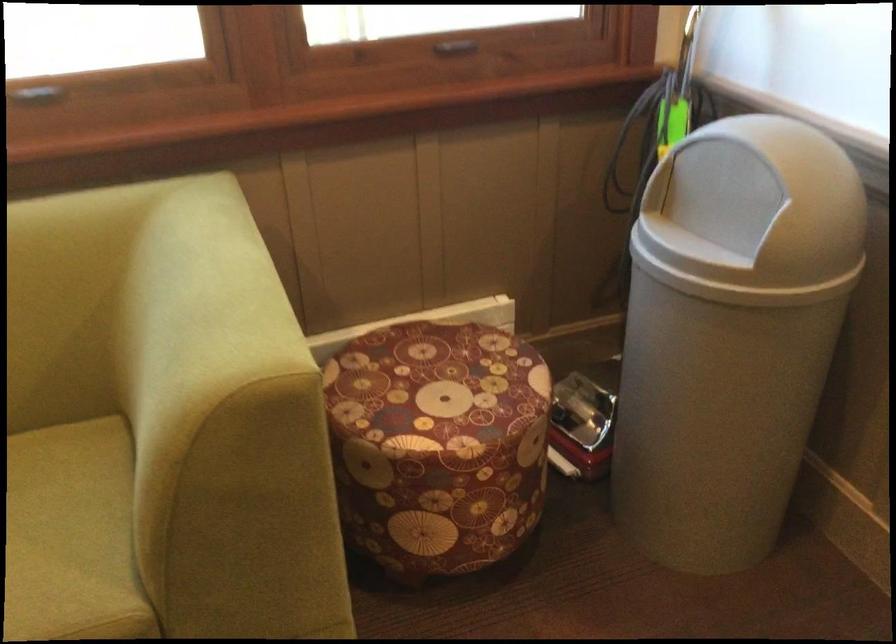
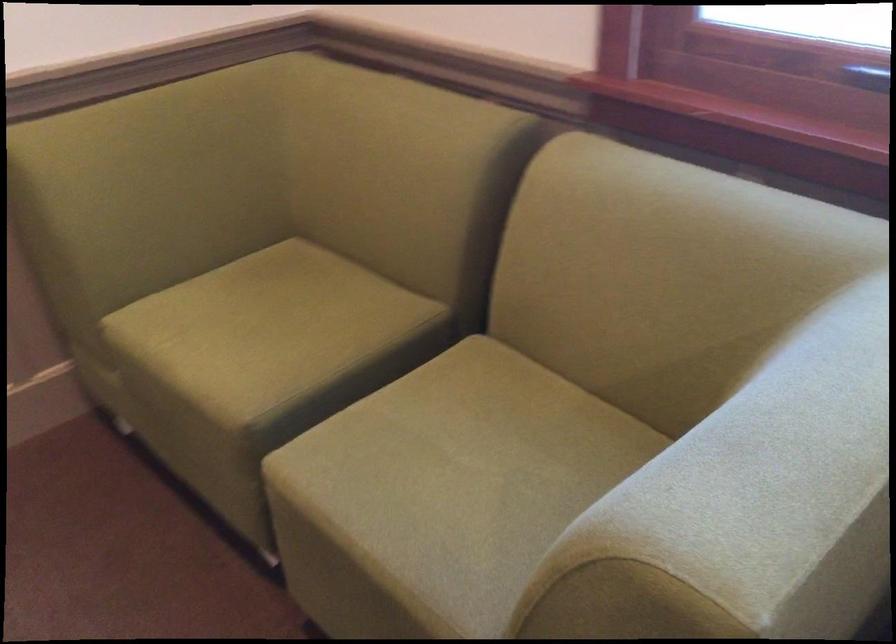
From the picture: Based on the continuous images, in which direction is the camera rotating?

The rotation direction of the camera is left-down.